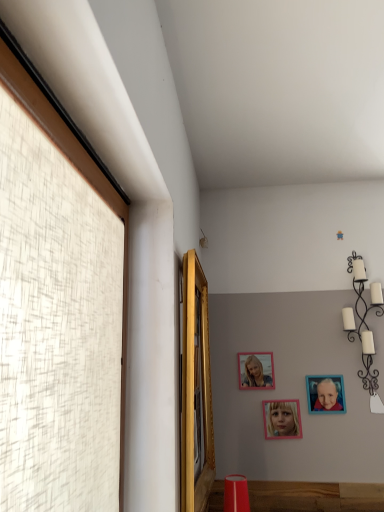
Question: Is pink matte picture frame at upper center, which is counted as the 1th picture frame, starting from the left, looking in the opposite direction of pink matte picture frame at center, acting as the 2th picture frame starting from the left?

Choices:
 (A) no
 (B) yes

Answer: (A)

Question: Is pink matte picture frame at upper center, which is counted as the 1th picture frame, starting from the left, outside pink matte picture frame at center, arranged as the 2th picture frame when viewed from the right?

Choices:
 (A) no
 (B) yes

Answer: (B)

Question: Is pink matte picture frame at upper center, which is counted as the 1th picture frame, starting from the left, further to camera compared to pink matte picture frame at center, acting as the 2th picture frame starting from the left?

Choices:
 (A) yes
 (B) no

Answer: (A)

Question: Considering the relative sizes of pink matte picture frame at upper center, which is counted as the 1th picture frame, starting from the left, and pink matte picture frame at center, acting as the 2th picture frame starting from the left, in the image provided, is pink matte picture frame at upper center, which is counted as the 1th picture frame, starting from the left, thinner than pink matte picture frame at center, acting as the 2th picture frame starting from the left,?

Choices:
 (A) no
 (B) yes

Answer: (B)

Question: Considering the relative positions of pink matte picture frame at upper center, the 3th picture frame viewed from the right, and pink matte picture frame at center, acting as the 2th picture frame starting from the left, in the image provided, is pink matte picture frame at upper center, the 3th picture frame viewed from the right, to the left of pink matte picture frame at center, acting as the 2th picture frame starting from the left, from the viewer's perspective?

Choices:
 (A) yes
 (B) no

Answer: (A)

Question: From the image's perspective, is matte white lampshade at upper center, the 2th lamp positioned from the front, located above or below white textured window at left, the first window positioned from the front?

Choices:
 (A) below
 (B) above

Answer: (B)

Question: Considering the positions of matte white lampshade at upper center, the 2th lamp positioned from the front, and white textured window at left, the first window positioned from the front, in the image, is matte white lampshade at upper center, the 2th lamp positioned from the front, taller or shorter than white textured window at left, the first window positioned from the front,?

Choices:
 (A) tall
 (B) short

Answer: (B)

Question: Considering their positions, is matte white lampshade at upper center, which ranks as the second lamp in right-to-left order, located in front of or behind white textured window at left, marked as the 1th window in a left-to-right arrangement?

Choices:
 (A) front
 (B) behind

Answer: (B)

Question: Is matte white lampshade at upper center, the first lamp when ordered from top to bottom, bigger or smaller than white textured window at left, marked as the 1th window in a left-to-right arrangement?

Choices:
 (A) small
 (B) big

Answer: (A)

Question: In terms of size, does gold wooden mirror at upper left, which is the first window in back-to-front order, appear bigger or smaller than pink matte picture frame at upper center, which is counted as the 1th picture frame, starting from the left?

Choices:
 (A) big
 (B) small

Answer: (A)

Question: Is gold wooden mirror at upper left, which ranks as the first window in right-to-left order, taller or shorter than pink matte picture frame at upper center, which is counted as the 1th picture frame, starting from the left?

Choices:
 (A) short
 (B) tall

Answer: (B)

Question: Considering their positions, is gold wooden mirror at upper left, which is the first window in back-to-front order, located in front of or behind pink matte picture frame at upper center, which is counted as the 1th picture frame, starting from the left?

Choices:
 (A) behind
 (B) front

Answer: (B)

Question: Is gold wooden mirror at upper left, which ranks as the first window in right-to-left order, inside or outside of pink matte picture frame at upper center, which is counted as the 1th picture frame, starting from the left?

Choices:
 (A) inside
 (B) outside

Answer: (B)

Question: From a real-world perspective, is pink matte picture frame at upper center, which is counted as the 1th picture frame, starting from the left, positioned above or below blue matte picture frame at upper right, marked as the 1th picture frame in a right-to-left arrangement?

Choices:
 (A) below
 (B) above

Answer: (B)

Question: From the image's perspective, is pink matte picture frame at upper center, the 3th picture frame viewed from the right, located above or below blue matte picture frame at upper right, marked as the 1th picture frame in a right-to-left arrangement?

Choices:
 (A) below
 (B) above

Answer: (B)